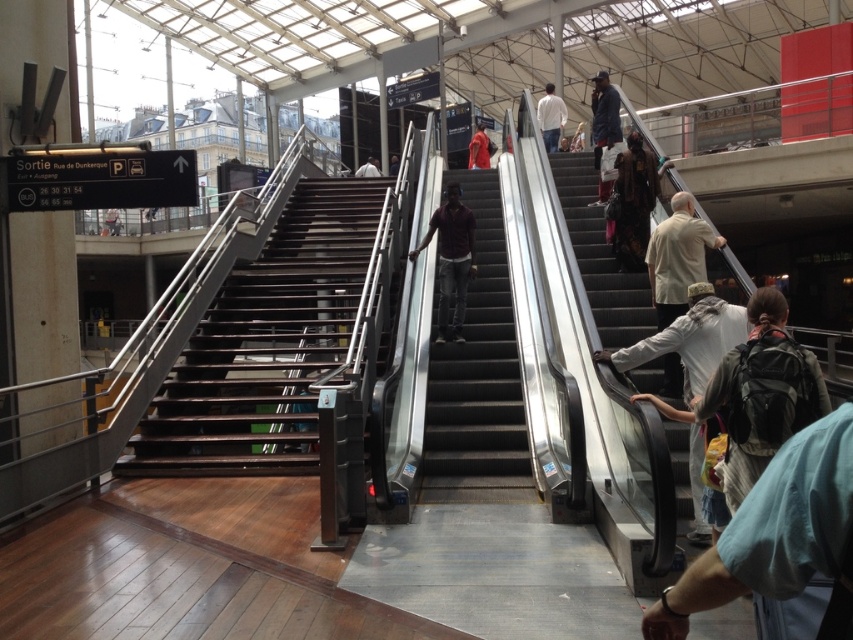
Question: Where is brown textured coat at upper right located in relation to dark brown leather jacket at upper center in the image?

Choices:
 (A) left
 (B) right

Answer: (A)

Question: Estimate the real-world distances between objects in this image. Which object is farther from the metallic gray escalator at center?

Choices:
 (A) metallic gray escalator at right
 (B) light gray fabric jacket at lower right
 (C) maroon shirt at center
 (D) brown textured coat at upper right

Answer: (D)

Question: Is the position of white matte shirt at upper center more distant than that of dark brown leather jacket at center?

Choices:
 (A) yes
 (B) no

Answer: (B)

Question: Is the position of light blue fabric at lower right more distant than that of dark blue jacket at upper right?

Choices:
 (A) no
 (B) yes

Answer: (A)

Question: Which of these objects is positioned closest to the maroon shirt at center?

Choices:
 (A) dark brown wooden stairs at center
 (B) light gray fabric jacket at lower right

Answer: (A)

Question: Estimate the real-world distances between objects in this image. Which object is farther from the light blue fabric at lower right?

Choices:
 (A) white matte shirt at upper center
 (B) light gray fabric jacket at lower right
 (C) metallic gray escalator at right

Answer: (A)